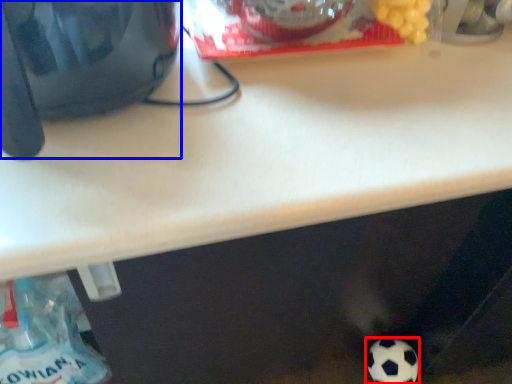
Question: Which of the following is the farthest to the observer, football (highlighted by a red box) or appliance (highlighted by a blue box)?

Choices:
 (A) football
 (B) appliance

Answer: (A)